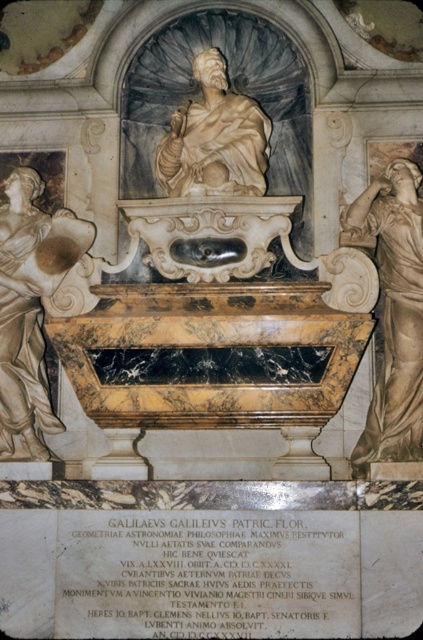
You are an art conservator tasked with measuring the statues for preservation. Given that the matte white statue at left is shorter than the matte gold statue at right, which statue would require a taller protective casing?

The matte gold statue at right requires a taller protective casing because it is taller than the matte white statue at left.

You are standing in front of the marble tomb and want to take a closer look at the matte gold statue at right. If your maximum comfortable viewing distance is 70 meters, can you view it comfortably without moving?

The matte gold statue at right is 69.65 meters away from camera, so yes, you can view it comfortably without moving since it is within your 70 meters limit.